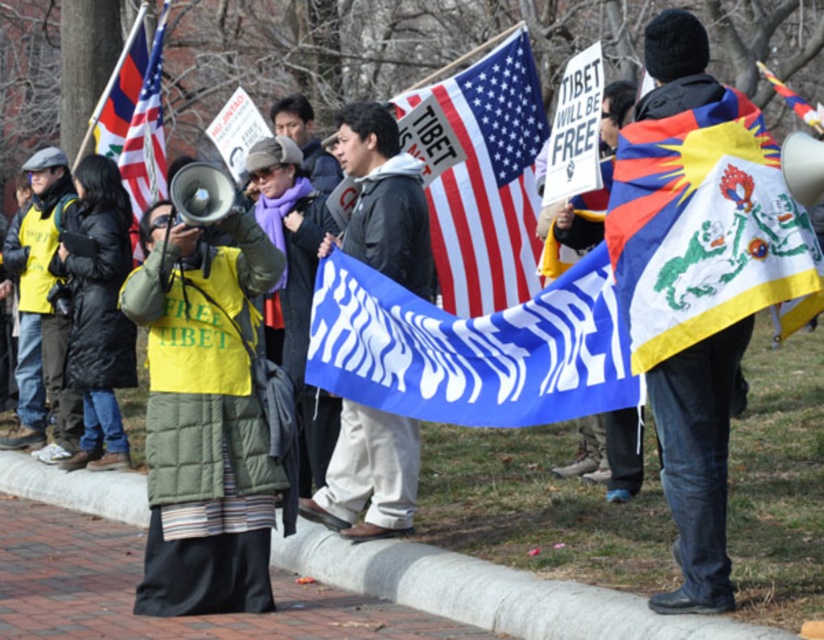
You are a photographer trying to capture the entire protest scene. You notice the blue fabric flag at center and the matte black flag at upper left. Which flag should you position closer to the camera to ensure both flags are visible in the frame?

The blue fabric flag at center is in front of the matte black flag at upper left, so positioning the blue fabric flag at center closer to the camera will ensure both flags remain visible without one blocking the other.

You are a photographer at the protest and want to capture both the blue fabric flag at center and the matte black flag at upper left in a single frame. Which flag should you focus on to ensure both are visible without needing to adjust your camera angle?

The blue fabric flag at center is shorter than the matte black flag at upper left, so focusing on the matte black flag at upper left will allow both flags to be in the frame without needing to adjust the camera angle.

Looking at this image, you are a photographer positioned at the center of the protest scene. You want to capture a photo that includes both the blue fabric flag at center and the matte black flag at upper left. What is the minimum distance you need to move backward to ensure both flags are in frame?

The blue fabric flag at center is 5.15 meters away from the matte black flag at upper left. To capture both flags in frame, you need to move backward at least 5.15 meters to ensure both are within the camera view.